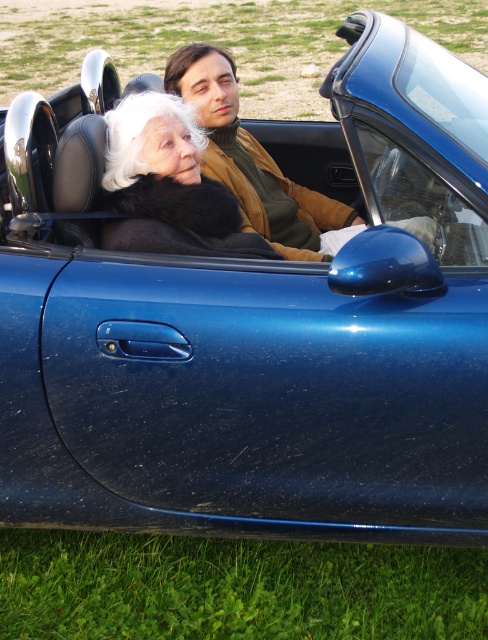
Question: Which of the following is the closest to the observer?

Choices:
 (A) (170, 244)
 (B) (305, 244)

Answer: (A)

Question: Which of the following is the farthest from the observer?

Choices:
 (A) (268, 188)
 (B) (170, 116)

Answer: (A)

Question: Observing the image, what is the correct spatial positioning of matte black fur coat at center in reference to brown leather jacket at center?

Choices:
 (A) below
 (B) above

Answer: (A)

Question: Is the position of matte black fur coat at center less distant than that of brown leather jacket at center?

Choices:
 (A) yes
 (B) no

Answer: (A)

Question: Does matte black fur coat at center appear on the right side of brown leather jacket at center?

Choices:
 (A) yes
 (B) no

Answer: (B)